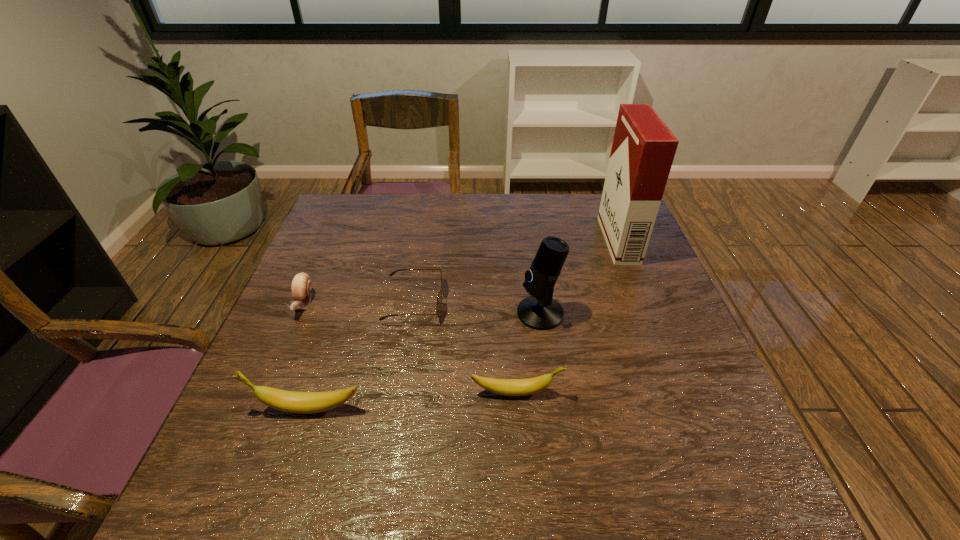
You are a GUI agent. You are given a task and a screenshot of the screen. Output one action in this format:
    pyautogui.click(x=<x>, y=<y>)
    Task: Click on the free space between the sunglasses and the escargot
    This screenshot has height=540, width=960.
    Given the screenshot: What is the action you would take?
    pyautogui.click(x=359, y=302)

Where is `unoccupied area between the fourth shortest object and the shorter banana`? unoccupied area between the fourth shortest object and the shorter banana is located at coordinates (412, 400).

This screenshot has width=960, height=540. In order to click on the second closest object to the farthest object in this screenshot , I will do `click(508, 387)`.

Point out which object is positioned as the second nearest to the shorter banana. Please provide its 2D coordinates. Your answer should be formatted as a tuple, i.e. [(x, y)], where the tuple contains the x and y coordinates of a point satisfying the conditions above.

[(439, 299)]

Find the location of a particular element. The image size is (960, 540). free point that satisfies the following two spatial constraints: 1. on the front-facing side of the tallest object; 2. on the front-facing side of the escargot is located at coordinates (643, 303).